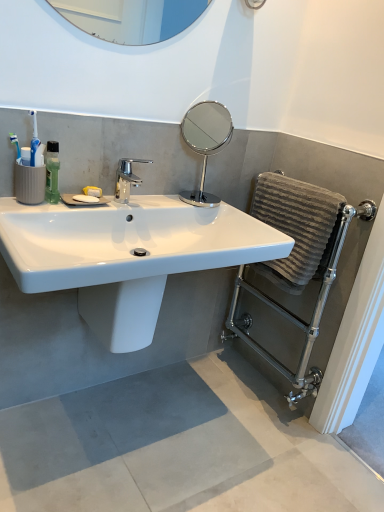
Question: Does gray concrete floor at lower center have a smaller size compared to polished chrome mirror at center?

Choices:
 (A) yes
 (B) no

Answer: (B)

Question: Does gray concrete floor at lower center lie behind polished chrome mirror at center?

Choices:
 (A) no
 (B) yes

Answer: (A)

Question: Is gray concrete floor at lower center at the left side of polished chrome mirror at center?

Choices:
 (A) no
 (B) yes

Answer: (B)

Question: Is gray concrete floor at lower center outside of polished chrome mirror at center?

Choices:
 (A) yes
 (B) no

Answer: (A)

Question: Is gray concrete floor at lower center looking in the opposite direction of polished chrome mirror at center?

Choices:
 (A) no
 (B) yes

Answer: (A)

Question: From the image's perspective, relative to white glossy bidet at center, is white glossy sink at center above or below?

Choices:
 (A) above
 (B) below

Answer: (A)

Question: Which is correct: white glossy sink at center is inside white glossy bidet at center, or outside of it?

Choices:
 (A) outside
 (B) inside

Answer: (A)

Question: Is white glossy sink at center wider or thinner than white glossy bidet at center?

Choices:
 (A) thin
 (B) wide

Answer: (B)

Question: Is white glossy sink at center to the left or to the right of white glossy bidet at center in the image?

Choices:
 (A) left
 (B) right

Answer: (B)

Question: From the image's perspective, is green matte bottle at left located above or below white glossy bidet at center?

Choices:
 (A) below
 (B) above

Answer: (B)

Question: Is green matte bottle at left in front of or behind white glossy bidet at center in the image?

Choices:
 (A) front
 (B) behind

Answer: (A)

Question: Is point (54, 202) closer or farther from the camera than point (160, 298)?

Choices:
 (A) closer
 (B) farther

Answer: (A)

Question: From a real-world perspective, is green matte bottle at left positioned above or below white glossy bidet at center?

Choices:
 (A) below
 (B) above

Answer: (B)

Question: Looking at their shapes, would you say polished chrome tap at center is wider or thinner than gray concrete floor at lower center?

Choices:
 (A) thin
 (B) wide

Answer: (A)

Question: Which is correct: polished chrome tap at center is inside gray concrete floor at lower center, or outside of it?

Choices:
 (A) outside
 (B) inside

Answer: (A)